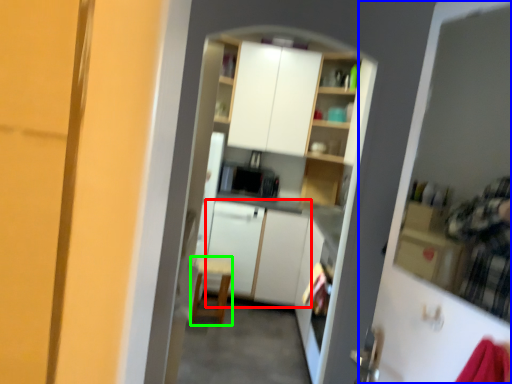
Question: Which object is the closest to the cabinetry (highlighted by a red box)? Choose among these: screen door (highlighted by a blue box) or chair (highlighted by a green box).

Choices:
 (A) screen door
 (B) chair

Answer: (B)